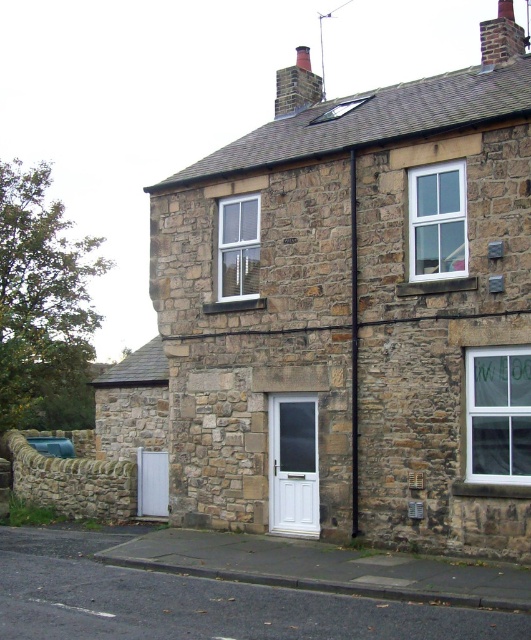
You are standing in front of the two story stone house and want to enter through the white plastic door at center. However, there is a smooth brick chimney at upper right in the way. Can you walk straight to the door without going around the chimney?

The white plastic door at center is closer to the viewer than the smooth brick chimney at upper right, so you can walk straight to the door without obstruction from the chimney.

You are standing in front of the two story stone house and want to know which of the two points, point (312,518) or point (286,67), is closer to you. Which one is closer?

Point (312,518) is closer to the camera than point (286,67).